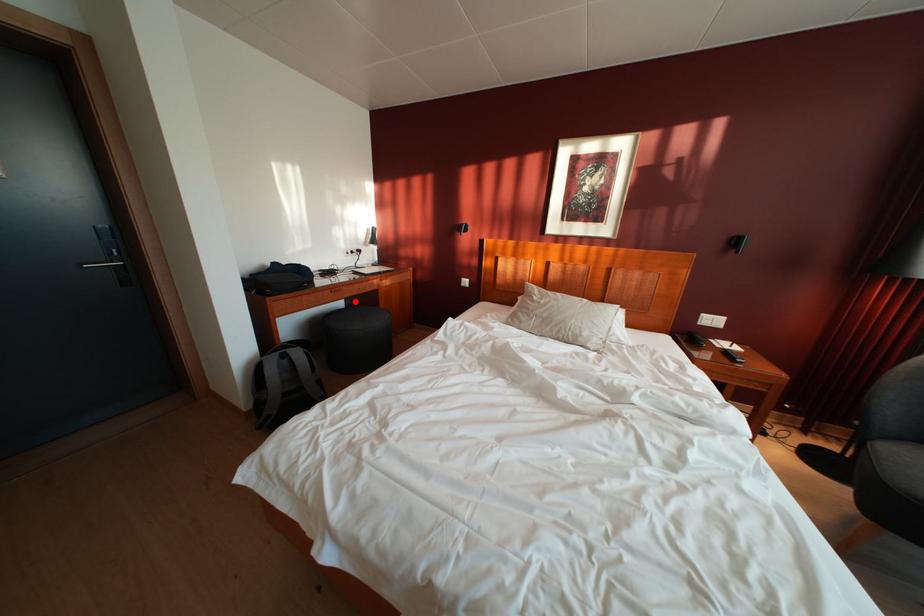
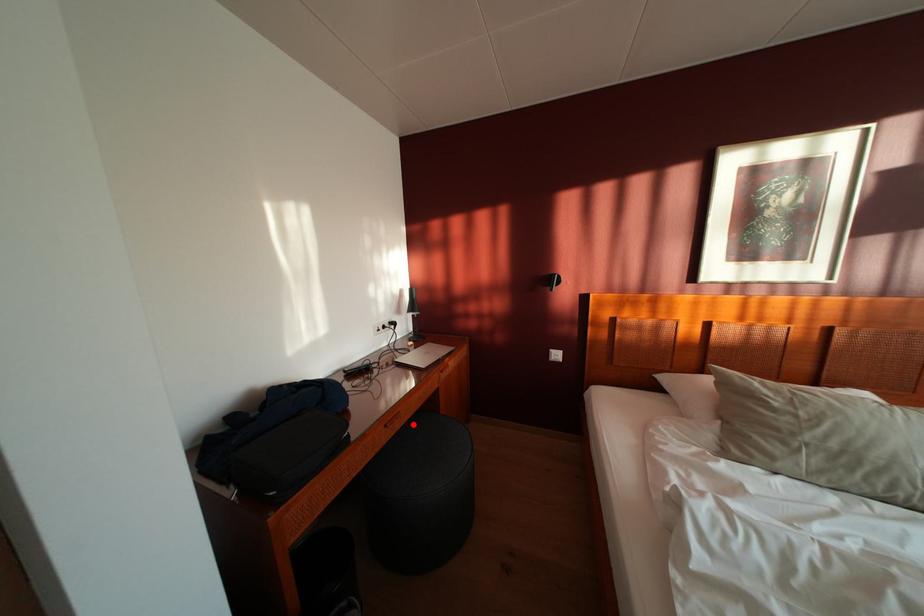
I am providing you with two images of the same scene from different viewpoints. A red point is marked on the first image and another point is marked on the second image. Do the highlighted points in image1 and image2 indicate the same real-world spot?

Yes